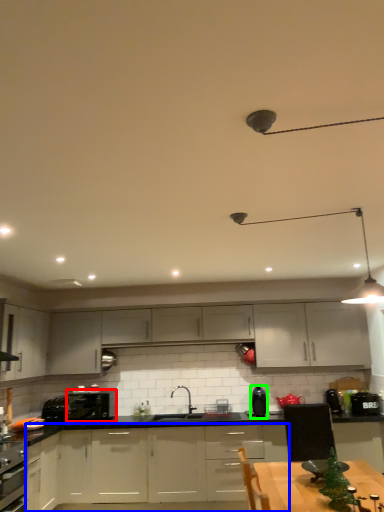
Question: Which object is the farthest from kitchen appliance (highlighted by a red box)? Choose among these: cabinetry (highlighted by a blue box) or kitchen appliance (highlighted by a green box).

Choices:
 (A) cabinetry
 (B) kitchen appliance

Answer: (B)